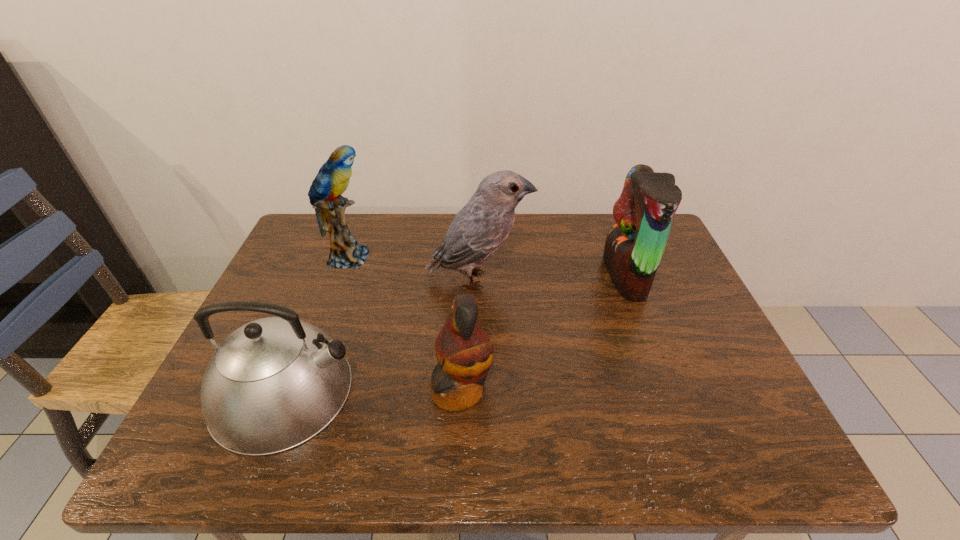
Find the location of `vacant space at the right edge`. vacant space at the right edge is located at coordinates (728, 414).

Locate an element on the screen. This screenshot has height=540, width=960. free space at the near right corner is located at coordinates (735, 433).

This screenshot has height=540, width=960. I want to click on vacant area between the leftmost parrot and the rightmost parrot, so tap(487, 266).

Where is `free area in between the kettle and the leftmost parrot`? Image resolution: width=960 pixels, height=540 pixels. free area in between the kettle and the leftmost parrot is located at coordinates (317, 324).

Locate an element on the screen. This screenshot has height=540, width=960. free space between the kettle and the nearest parrot is located at coordinates (373, 390).

Find the location of `free space between the nearest parrot and the leftmost parrot`. free space between the nearest parrot and the leftmost parrot is located at coordinates (404, 323).

Locate an element on the screen. The height and width of the screenshot is (540, 960). free point between the leftmost parrot and the rightmost parrot is located at coordinates click(487, 266).

Identify the location of object that stands as the second closest to the rightmost parrot. (464, 351).

Identify the location of object that stands as the third closest to the kettle. The width and height of the screenshot is (960, 540). (332, 180).

Locate which parrot ranks third in proximity to the leftmost parrot. Please provide its 2D coordinates. Your answer should be formatted as a tuple, i.e. [(x, y)], where the tuple contains the x and y coordinates of a point satisfying the conditions above.

[(634, 247)]